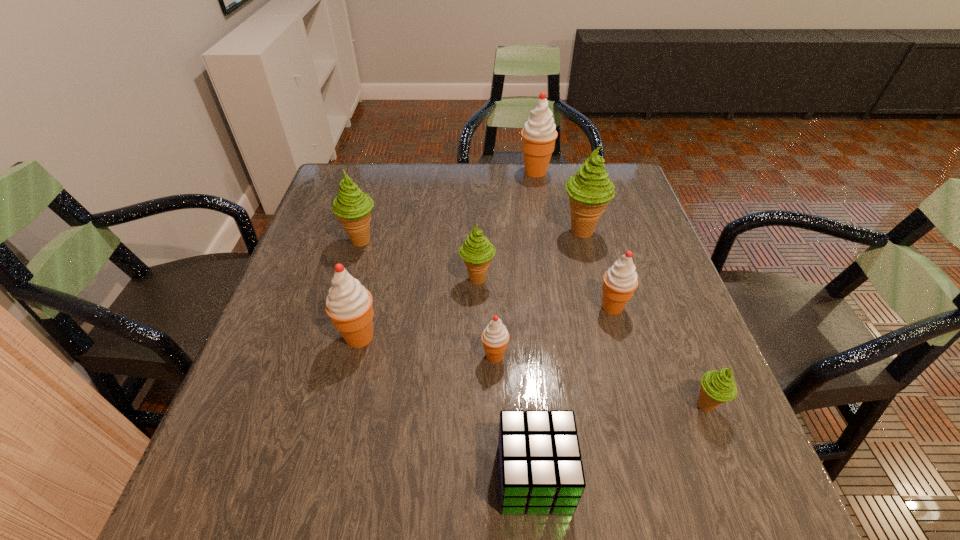
The image size is (960, 540). Identify the location of vacant space at the near right corner of the desktop. (725, 481).

Image resolution: width=960 pixels, height=540 pixels. Find the location of `free point between the fourth nearest icecream and the biggest green icecream`. free point between the fourth nearest icecream and the biggest green icecream is located at coordinates (597, 269).

Locate an element on the screen. The image size is (960, 540). vacant point located between the third green icecream from right to left and the red cube is located at coordinates (506, 379).

At what (x,y) coordinates should I click in order to perform the action: click on vacant area that lies between the third red icecream from right to left and the leftmost green icecream. Please return your answer as a coordinate pair (x, y). The image size is (960, 540). Looking at the image, I should click on (428, 299).

Where is `vacant space that is in between the second biggest green icecream and the fifth nearest object`? Image resolution: width=960 pixels, height=540 pixels. vacant space that is in between the second biggest green icecream and the fifth nearest object is located at coordinates (487, 274).

Identify the location of free spot between the second biggest red icecream and the red cube. (446, 407).

You are a GUI agent. You are given a task and a screenshot of the screen. Output one action in this format:
    pyautogui.click(x=<x>, y=<y>)
    Task: Click on the empty location between the leftmost green icecream and the third green icecream from right to left
    This screenshot has height=540, width=960.
    Given the screenshot: What is the action you would take?
    pyautogui.click(x=420, y=260)

Where is `vacant area that lies between the biggest red icecream and the second green icecream from right to left`? The image size is (960, 540). vacant area that lies between the biggest red icecream and the second green icecream from right to left is located at coordinates (559, 202).

You are a GUI agent. You are given a task and a screenshot of the screen. Output one action in this format:
    pyautogui.click(x=<x>, y=<y>)
    Task: Click on the free space that is in between the farthest icecream and the third red icecream from right to left
    This screenshot has width=960, height=540.
    Given the screenshot: What is the action you would take?
    pyautogui.click(x=516, y=264)

The height and width of the screenshot is (540, 960). In order to click on vacant region between the biggest green icecream and the nearest object in this screenshot , I will do `click(558, 355)`.